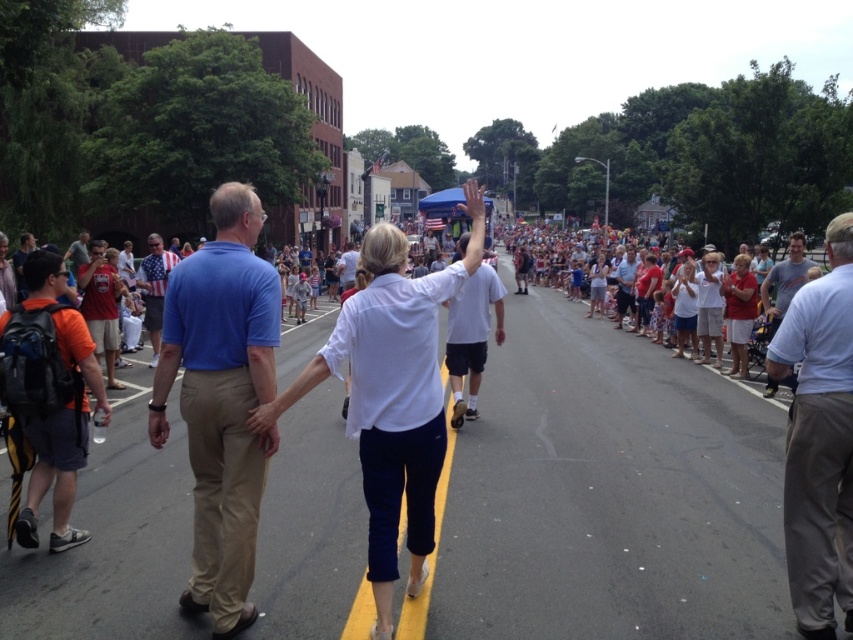
Question: Can you confirm if blue cotton shirt at center is positioned to the right of american flag shirt at center?

Choices:
 (A) no
 (B) yes

Answer: (B)

Question: Does blue cotton shirt at center appear under gray cotton pants at right?

Choices:
 (A) no
 (B) yes

Answer: (A)

Question: Can you confirm if matte red t-shirt at left is wider than american flag shirt at center?

Choices:
 (A) no
 (B) yes

Answer: (A)

Question: Which of these objects is positioned closest to the american flag shirt at center?

Choices:
 (A) white cotton shirt at center
 (B) blue cotton shirt at center
 (C) matte red t-shirt at left

Answer: (C)

Question: Which of the following is the farthest from the observer?

Choices:
 (A) (41, 461)
 (B) (223, 257)
 (C) (93, 244)

Answer: (C)

Question: Which point is closer to the camera?

Choices:
 (A) blue cotton shirt at center
 (B) gray cotton pants at right

Answer: (B)